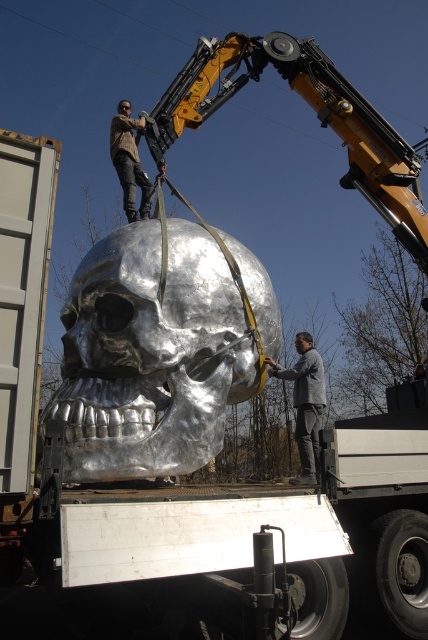
You are a delivery driver who needs to load the shiny metallic skull at center and the brown leather jacket at upper center into a truck. The truck bed has a height limit of 2.5 meters. Can both items be placed in the truck bed without exceeding the height limit?

The distance between the shiny metallic skull at center and the brown leather jacket at upper center is 2.41 meters. Since the truck bed has a height limit of 2.5 meters, both items can be placed in the truck bed as their combined height does not exceed the limit.

Consider the image. You are standing in front of the crane and the skull sculpture. There are two points marked on the crane arm. The first point is at coordinates point (140,280) and the second point is at point (299,353). Which point is closer to you?

Point (140,280) is closer to the viewer than point (299,353).